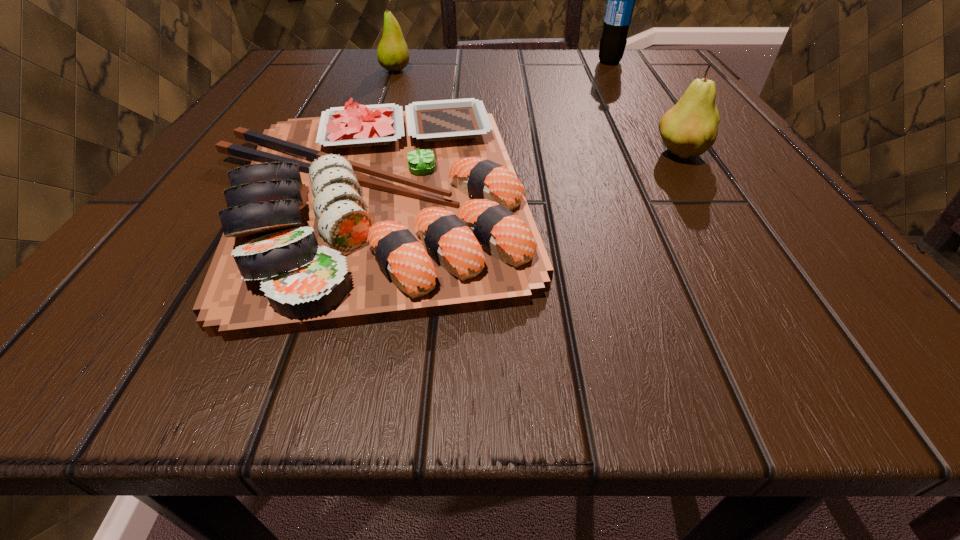
Locate an element on the screen. vacant region that satisfies the following two spatial constraints: 1. on the front side of the left pear; 2. on the left side of the nearer pear is located at coordinates (366, 154).

Where is `free space that satisfies the following two spatial constraints: 1. on the back side of the shortest object; 2. on the right side of the tallest object`? The height and width of the screenshot is (540, 960). free space that satisfies the following two spatial constraints: 1. on the back side of the shortest object; 2. on the right side of the tallest object is located at coordinates (409, 62).